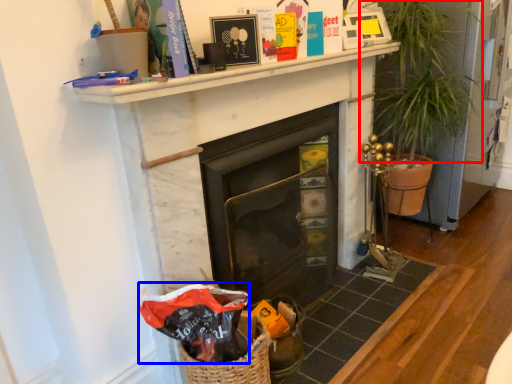
Question: Which object is further to the camera taking this photo, plant (highlighted by a red box) or gift bag (highlighted by a blue box)?

Choices:
 (A) plant
 (B) gift bag

Answer: (A)